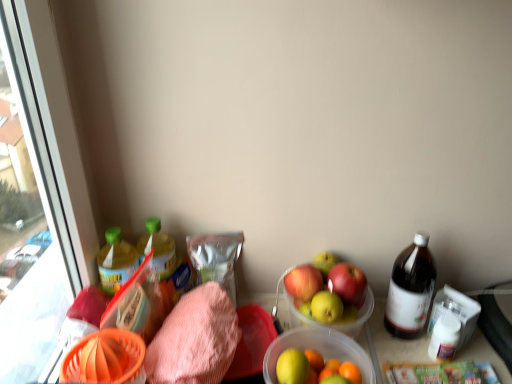
Question: Considering the relative positions of pink terry cloth towel at lower left and translucent plastic bowl at center in the image provided, is pink terry cloth towel at lower left to the right of translucent plastic bowl at center from the viewer's perspective?

Choices:
 (A) yes
 (B) no

Answer: (B)

Question: From the image's perspective, is pink terry cloth towel at lower left over translucent plastic bowl at center?

Choices:
 (A) no
 (B) yes

Answer: (B)

Question: From a real-world perspective, is pink terry cloth towel at lower left below translucent plastic bowl at center?

Choices:
 (A) yes
 (B) no

Answer: (A)

Question: Is pink terry cloth towel at lower left smaller than translucent plastic bowl at center?

Choices:
 (A) yes
 (B) no

Answer: (B)

Question: Can you confirm if pink terry cloth towel at lower left is thinner than translucent plastic bowl at center?

Choices:
 (A) yes
 (B) no

Answer: (A)

Question: From a real-world perspective, is translucent plastic bowl at center physically located above or below green plastic bottle at left, the third bottle in the right-to-left sequence?

Choices:
 (A) above
 (B) below

Answer: (B)

Question: Based on their sizes in the image, would you say translucent plastic bowl at center is bigger or smaller than green plastic bottle at left, the third bottle in the right-to-left sequence?

Choices:
 (A) small
 (B) big

Answer: (B)

Question: From the image's perspective, is translucent plastic bowl at center above or below green plastic bottle at left, positioned as the first bottle in left-to-right order?

Choices:
 (A) below
 (B) above

Answer: (A)

Question: Is translucent plastic bowl at center in front of or behind green plastic bottle at left, the third bottle in the right-to-left sequence, in the image?

Choices:
 (A) behind
 (B) front

Answer: (B)

Question: Is point (101, 251) closer or farther from the camera than point (205, 340)?

Choices:
 (A) farther
 (B) closer

Answer: (A)

Question: Looking at their shapes, would you say green plastic bottle at left, the third bottle in the right-to-left sequence, is wider or thinner than pink terry cloth towel at lower left?

Choices:
 (A) thin
 (B) wide

Answer: (A)

Question: Do you think green plastic bottle at left, positioned as the first bottle in left-to-right order, is within pink terry cloth towel at lower left, or outside of it?

Choices:
 (A) inside
 (B) outside

Answer: (B)

Question: From the image's perspective, is green plastic bottle at left, the third bottle in the right-to-left sequence, positioned above or below pink terry cloth towel at lower left?

Choices:
 (A) below
 (B) above

Answer: (B)

Question: Is translucent plastic bowl at center bigger or smaller than brown glass bottle at right, arranged as the 3th bottle when viewed from the left?

Choices:
 (A) big
 (B) small

Answer: (A)

Question: From the image's perspective, relative to brown glass bottle at right, the 1th bottle viewed from the right, is translucent plastic bowl at center above or below?

Choices:
 (A) below
 (B) above

Answer: (A)